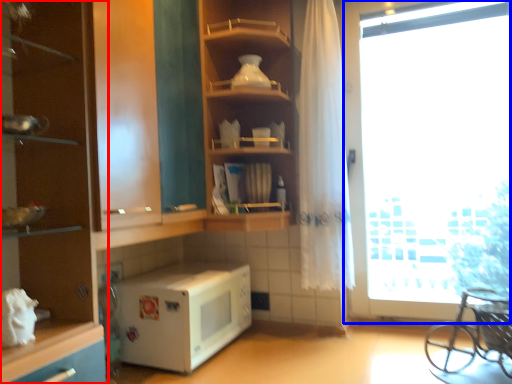
Question: Which of the following is the farthest to the observer, cabinetry (highlighted by a red box) or window (highlighted by a blue box)?

Choices:
 (A) cabinetry
 (B) window

Answer: (B)